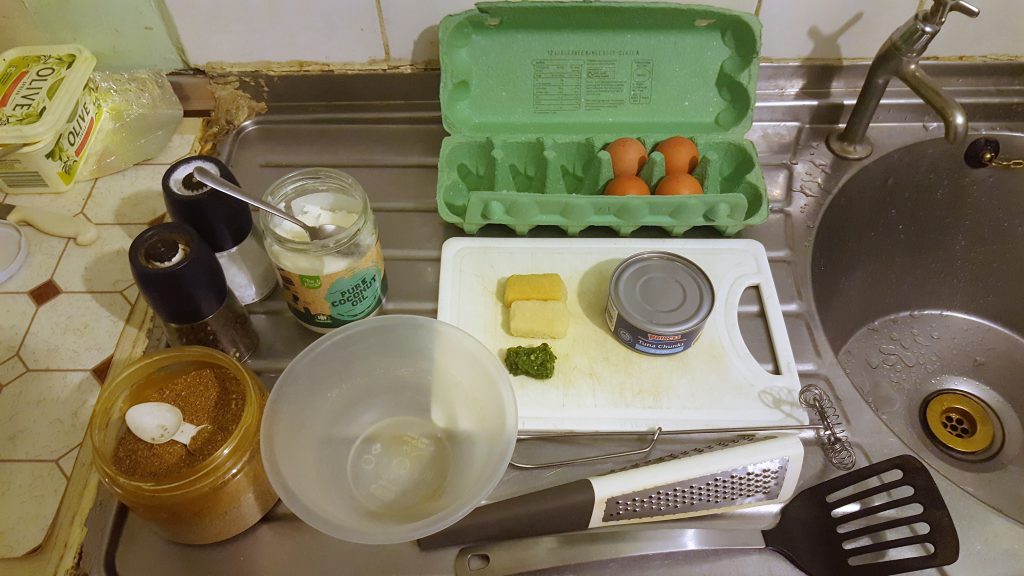
Locate an element on the screen. bowl is located at coordinates (354, 420).